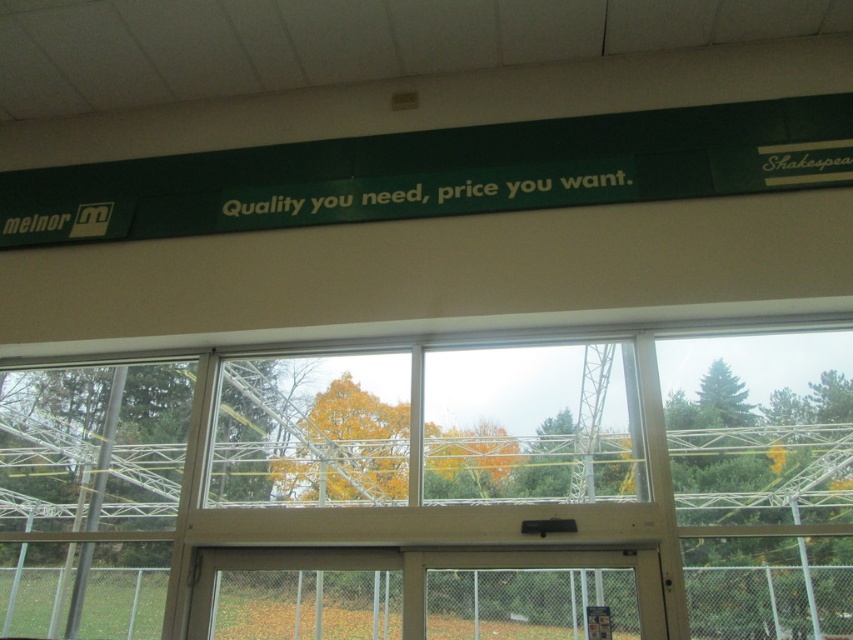
You are a customer entering the store and see the transparent glass window at center and the green matte signboard at upper center. Which object is closer to the left side of the store?

The transparent glass window at center is closer to the left side of the store because it is positioned to the left of the green matte signboard at upper center.

You are a customer entering the store and notice both the transparent glass window at center and the green matte signboard at upper center. Which object is wider from your perspective?

The transparent glass window at center is wider than the green matte signboard at upper center according to the description.

You are a delivery person carrying a box that is 1.2 meters long. You need to move it through the space between the transparent glass window at center and the green matte signboard at upper center. Will the box fit through that space?

The distance between the transparent glass window at center and the green matte signboard at upper center is 1.08 meters. Since the box is 1.2 meters long, it will not fit through the space between them.